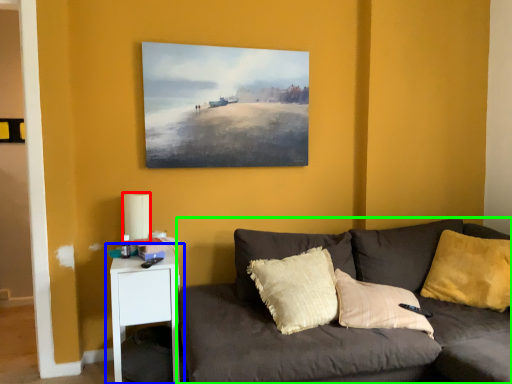
Question: Estimate the real-world distances between objects in this image. Which object is farther from lamp (highlighted by a red box), nightstand (highlighted by a blue box) or studio couch (highlighted by a green box)?

Choices:
 (A) nightstand
 (B) studio couch

Answer: (B)